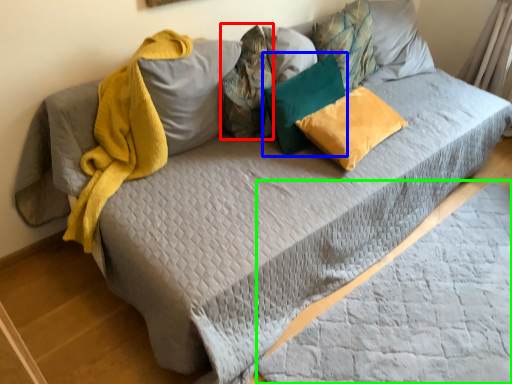
Question: Which is nearer to the pillow (highlighted by a red box)? pillow (highlighted by a blue box) or sheet (highlighted by a green box).

Choices:
 (A) pillow
 (B) sheet

Answer: (A)